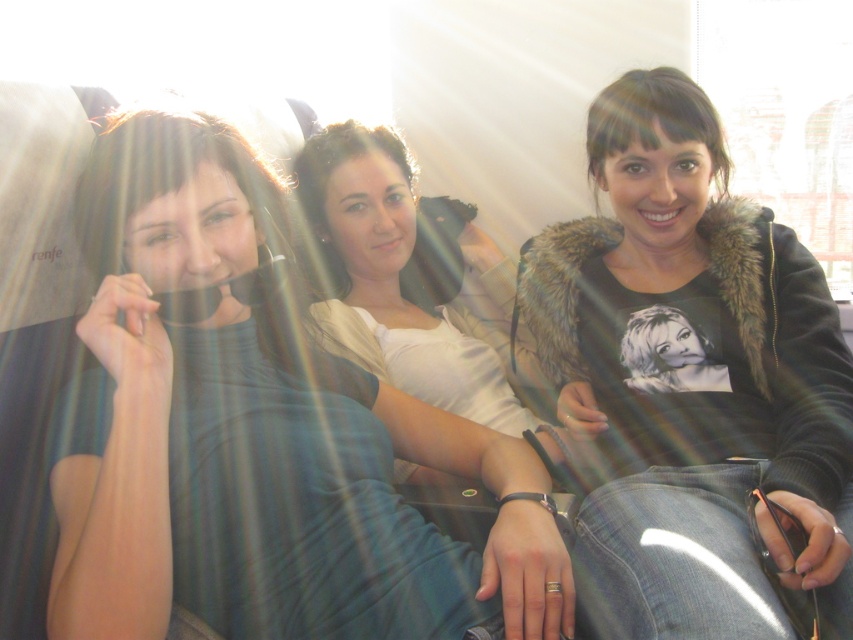
Question: Which object is farther from the camera taking this photo?

Choices:
 (A) fuzzy black jacket at center
 (B) matte black shirt at left
 (C) white satin shirt at center

Answer: (C)

Question: Considering the real-world distances, which object is farthest from the matte black shirt at left?

Choices:
 (A) fuzzy black jacket at center
 (B) white satin shirt at center

Answer: (B)

Question: Is matte black shirt at left wider than white satin shirt at center?

Choices:
 (A) no
 (B) yes

Answer: (B)

Question: Can you confirm if matte black shirt at left is positioned above white satin shirt at center?

Choices:
 (A) yes
 (B) no

Answer: (B)

Question: Which object appears closest to the camera in this image?

Choices:
 (A) white satin shirt at center
 (B) matte black shirt at left

Answer: (B)

Question: Is fuzzy black jacket at center above white satin shirt at center?

Choices:
 (A) yes
 (B) no

Answer: (B)